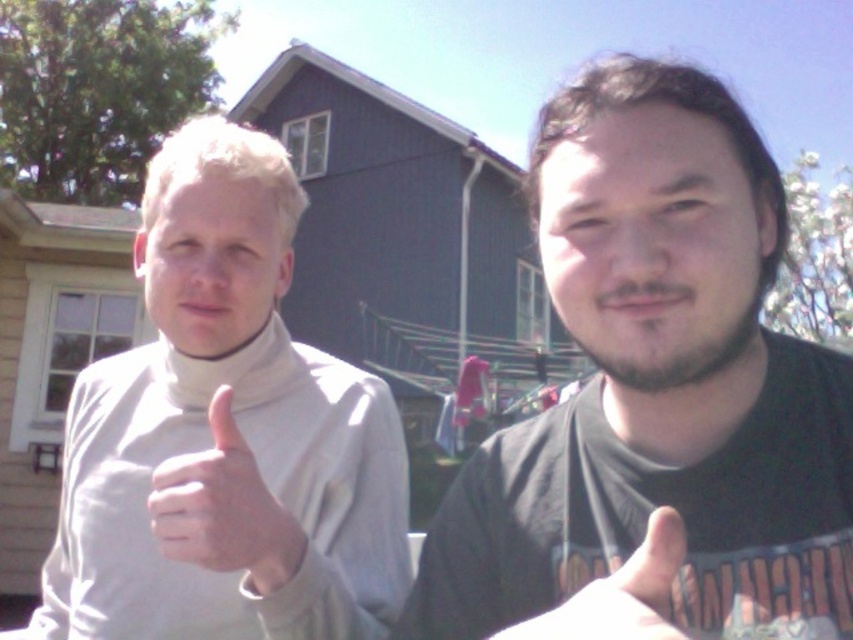
Is point (728, 198) in front of point (195, 497)?

Yes, point (728, 198) is in front of point (195, 497).

Between point (779, 573) and point (236, 470), which one is positioned behind?

Point (236, 470)

Who is more forward, (668, 202) or (230, 464)?

Point (668, 202)

This screenshot has width=853, height=640. Identify the location of black matte shirt at right. (659, 388).

Is point (270, 618) in front of point (242, 467)?

No, it is not.

Which is in front, point (190, 433) or point (270, 516)?

Point (270, 516) is in front.

Does point (339, 465) come behind point (235, 429)?

Yes, it is.

At what (x,y) coordinates should I click in order to perform the action: click on light gray turtleneck sweater at left. Please return your answer as a coordinate pair (x, y). The width and height of the screenshot is (853, 640). Looking at the image, I should click on (224, 435).

Which is above, black matte shirt at right or white matte hand at center?

black matte shirt at right is higher up.

Between black matte shirt at right and white matte hand at center, which one appears on the left side from the viewer's perspective?

white matte hand at center

Find the location of a particular element. black matte shirt at right is located at coordinates (659, 388).

You are a GUI agent. You are given a task and a screenshot of the screen. Output one action in this format:
    pyautogui.click(x=<x>, y=<y>)
    Task: Click on the black matte shirt at right
    Image resolution: width=853 pixels, height=640 pixels.
    Given the screenshot: What is the action you would take?
    pyautogui.click(x=659, y=388)